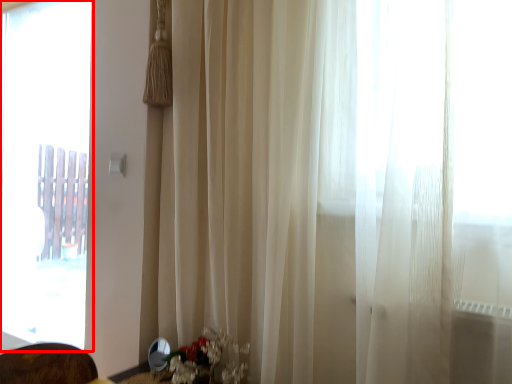
Question: From the image's perspective, considering the relative positions of window (annotated by the red box) and floral arrangement in the image provided, where is window (annotated by the red box) located with respect to the staircase?

Choices:
 (A) below
 (B) above

Answer: (B)